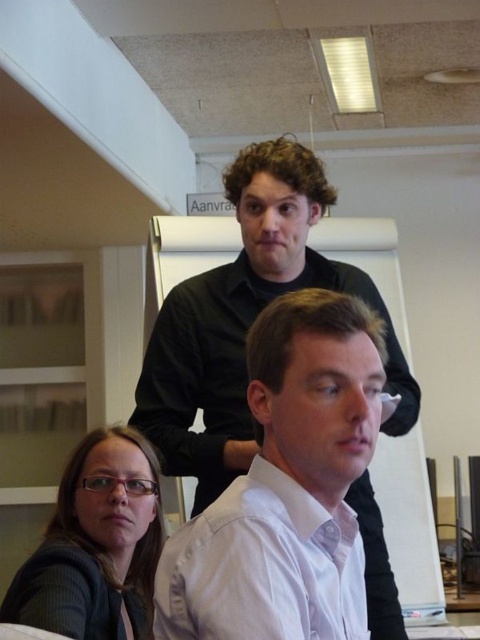
You are standing in the office scene described. You need to reach a point that is 1.55 meters away from you. Can you confirm if the point at coordinates (188, 387) is exactly that distance away?

Yes, the point at coordinates (188, 387) is exactly 1.55 meters away from the viewer, so it matches the required distance.

You are a photographer setting up a shot of the scene described. You need to ensure that both the black matte shirt at upper center and the matte black glasses at lower left are in focus. Given their positions, which object should you focus on first to ensure both are sharp?

The black matte shirt at upper center is located above matte black glasses at lower left, so you should focus on the black matte shirt at upper center first to ensure both are in focus as they are stacked vertically.